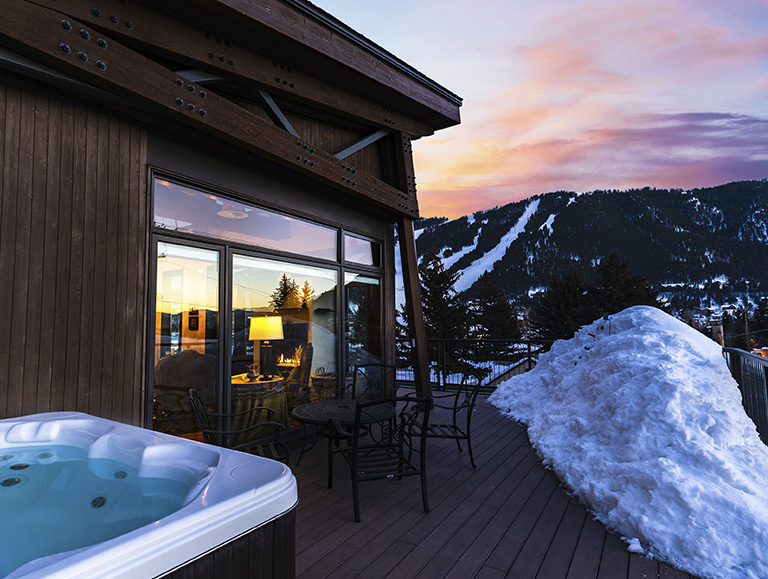
Identify the location of chair. (439, 426), (376, 470), (243, 439).